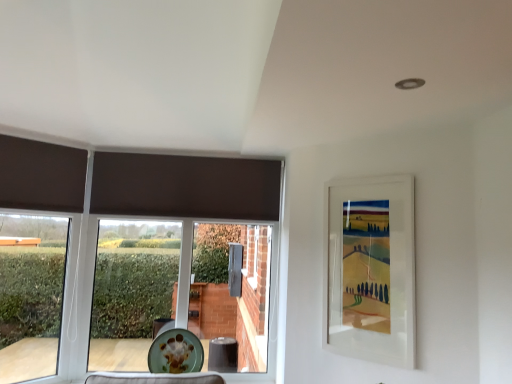
Question: Is green glazed plate at lower center bigger or smaller than white matte picture frame at upper right?

Choices:
 (A) small
 (B) big

Answer: (A)

Question: Considering the positions of green glazed plate at lower center and white matte picture frame at upper right in the image, is green glazed plate at lower center wider or thinner than white matte picture frame at upper right?

Choices:
 (A) thin
 (B) wide

Answer: (B)

Question: Which object is the closest to the matte brown curtain at left?

Choices:
 (A) white matte picture frame at upper right
 (B) green glazed plate at lower center

Answer: (B)

Question: Considering the real-world distances, which object is farthest from the green glazed plate at lower center?

Choices:
 (A) matte brown curtain at left
 (B) white matte picture frame at upper right

Answer: (B)